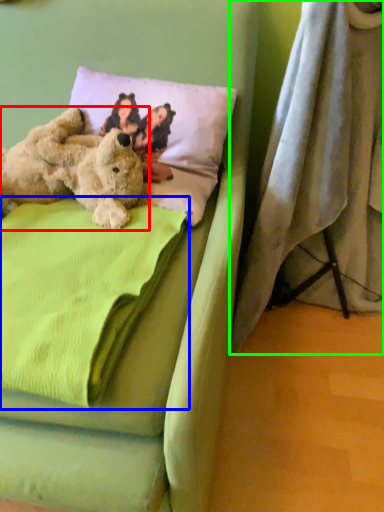
Question: Estimate the real-world distances between objects in this image. Which object is closer to teddy bear (highlighted by a red box), blanket (highlighted by a blue box) or curtain (highlighted by a green box)?

Choices:
 (A) blanket
 (B) curtain

Answer: (A)